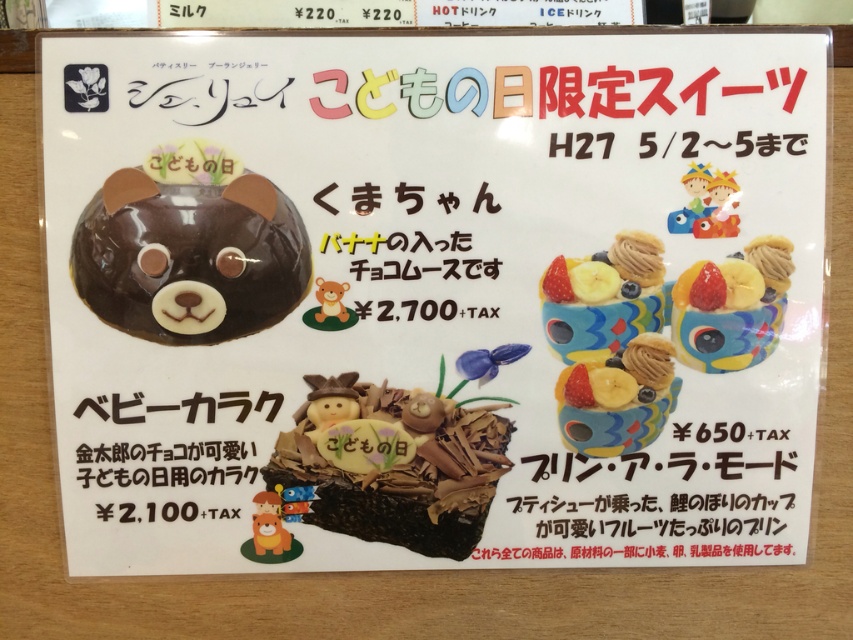
You are a customer looking at the poster and want to order the matte ceramic cupcake at upper right. The menu shows a price tag at point [730,307]. Where is the price for the matte ceramic cupcake at upper right located on the poster?

The price for the matte ceramic cupcake at upper right is located at point [730,307].